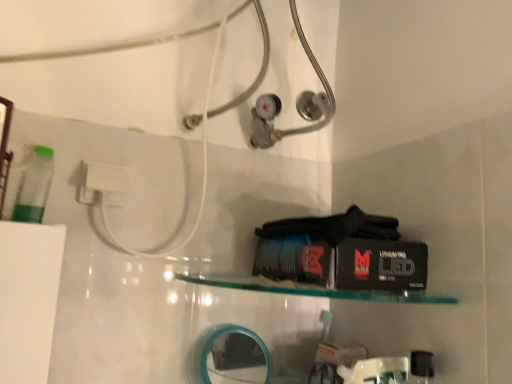
Question: Should I look upward or downward to see teal plastic mirror at lower center?

Choices:
 (A) up
 (B) down

Answer: (B)

Question: From the image's perspective, does teal plastic mirror at lower center appear higher than white plastic plug at upper left?

Choices:
 (A) yes
 (B) no

Answer: (B)

Question: Is teal plastic mirror at lower center oriented towards white plastic plug at upper left?

Choices:
 (A) yes
 (B) no

Answer: (B)

Question: From a real-world perspective, is teal plastic mirror at lower center under white plastic plug at upper left?

Choices:
 (A) yes
 (B) no

Answer: (A)

Question: Is teal plastic mirror at lower center to the left of white plastic plug at upper left from the viewer's perspective?

Choices:
 (A) yes
 (B) no

Answer: (B)

Question: From a real-world perspective, does teal plastic mirror at lower center stand above white plastic plug at upper left?

Choices:
 (A) yes
 (B) no

Answer: (B)

Question: Is teal plastic mirror at lower center shorter than white plastic plug at upper left?

Choices:
 (A) yes
 (B) no

Answer: (B)

Question: Does clear glass shelf at center turn towards white plastic plug at upper left?

Choices:
 (A) yes
 (B) no

Answer: (B)

Question: Does clear glass shelf at center have a greater height compared to white plastic plug at upper left?

Choices:
 (A) no
 (B) yes

Answer: (A)

Question: From a real-world perspective, is clear glass shelf at center beneath white plastic plug at upper left?

Choices:
 (A) no
 (B) yes

Answer: (B)

Question: From the image's perspective, would you say clear glass shelf at center is positioned over white plastic plug at upper left?

Choices:
 (A) yes
 (B) no

Answer: (B)

Question: Does clear glass shelf at center have a lesser height compared to white plastic plug at upper left?

Choices:
 (A) yes
 (B) no

Answer: (A)

Question: Does clear glass shelf at center have a larger size compared to white plastic plug at upper left?

Choices:
 (A) no
 (B) yes

Answer: (B)

Question: Can you confirm if white plastic plug at upper left is taller than clear glass shelf at center?

Choices:
 (A) no
 (B) yes

Answer: (B)